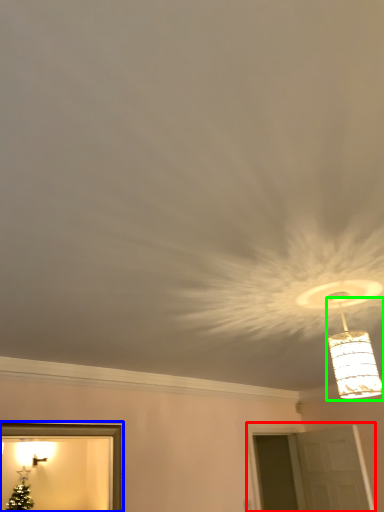
Question: Which object is positioned farthest from window (highlighted by a red box)? Select from picture frame (highlighted by a blue box) and lamp (highlighted by a green box).

Choices:
 (A) picture frame
 (B) lamp

Answer: (B)